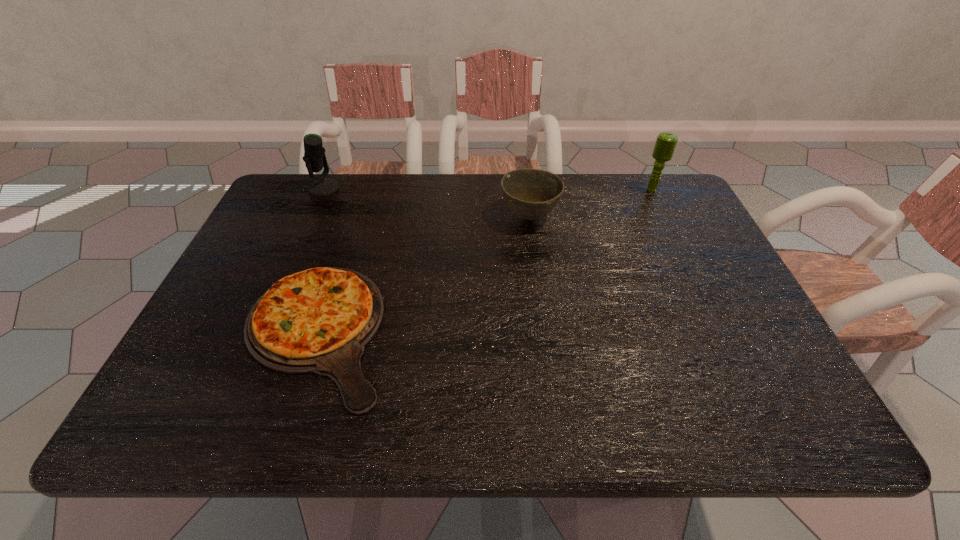
Image resolution: width=960 pixels, height=540 pixels. In order to click on the rightmost object in this screenshot , I will do point(666,142).

I want to click on the left microphone, so [x=314, y=157].

The width and height of the screenshot is (960, 540). Identify the location of bowl. (531, 193).

The image size is (960, 540). What are the coordinates of `the third object from left to right` in the screenshot? It's located at (531, 193).

Find the location of `the shortest object`. the shortest object is located at coordinates (319, 320).

Where is `the nearest object`? The width and height of the screenshot is (960, 540). the nearest object is located at coordinates (319, 320).

Where is `free point located on the right of the right microphone`? free point located on the right of the right microphone is located at coordinates (680, 190).

This screenshot has height=540, width=960. Find the location of `vacant space located on the front of the left microphone`. vacant space located on the front of the left microphone is located at coordinates (303, 234).

This screenshot has height=540, width=960. Identify the location of free space located 0.240m on the right of the third object from left to right. (643, 216).

The height and width of the screenshot is (540, 960). Find the location of `vacant space situated on the back of the pizza`. vacant space situated on the back of the pizza is located at coordinates (341, 257).